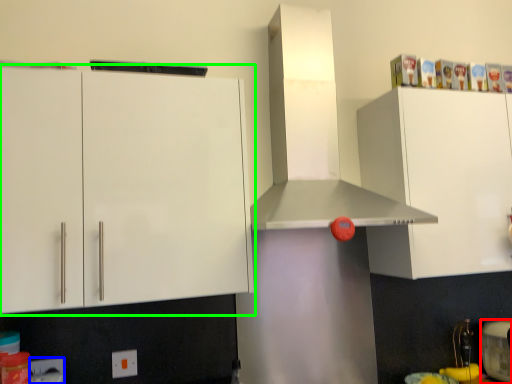
Question: Which is nearer to the appliance (highlighted by a red box)? electric outlet (highlighted by a blue box) or cabinetry (highlighted by a green box).

Choices:
 (A) electric outlet
 (B) cabinetry

Answer: (B)